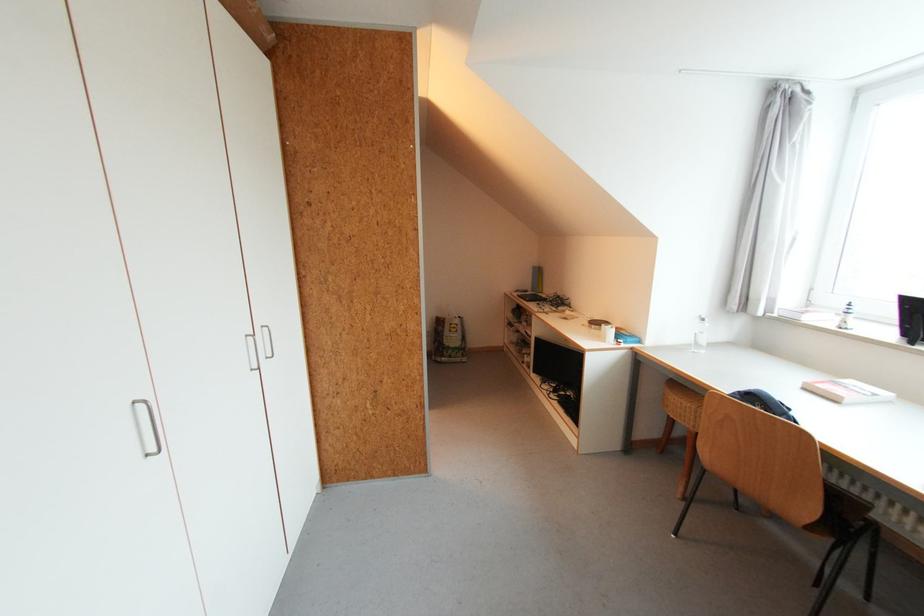
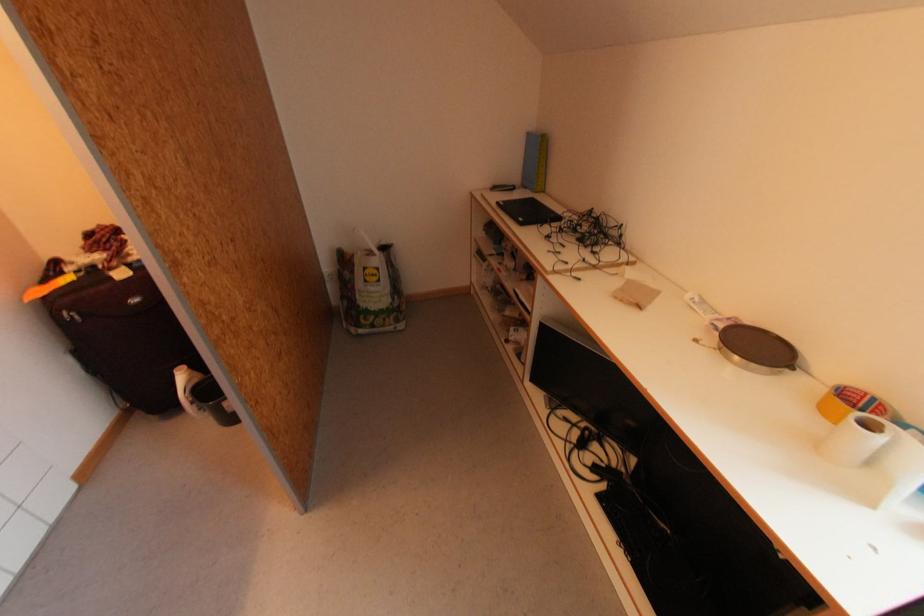
Where in the second image is the point corresponding to (523,296) from the first image?

(503, 205)